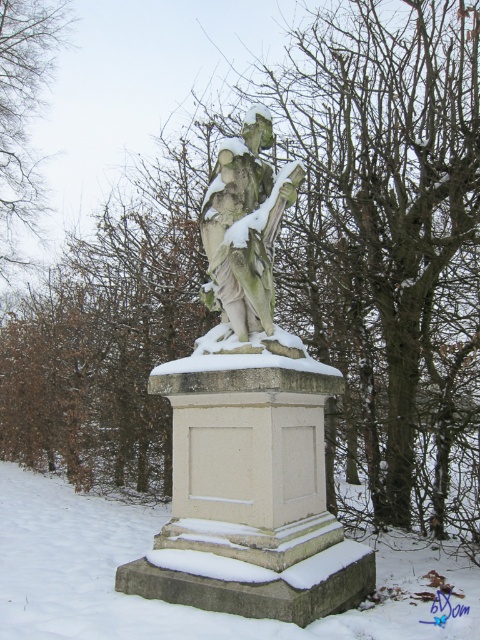
You are an artist planning to paint the statue and its surroundings. You want to ensure the white frosty snow at base and the brown leafless tree at upper left are proportionally accurate. Based on the scene, which object should you depict as larger in your painting?

The brown leafless tree at upper left should be depicted as larger in the painting because the white frosty snow at base has a smaller size compared to it.

From the picture: You are a delivery person trying to navigate through the snowy area. You need to place a package between the stone statue at center and the brown leafless tree at upper left. Is there enough space to place the package there?

The stone statue at center and brown leafless tree at upper left are 8.16 meters apart, so there is sufficient space to place the package between them.

In the scene shown: You are standing near the statue and want to take a photo of the brown leafless tree at upper left without the white frosty snow at base in the frame. Which direction should you move to ensure the tree is visible while excluding the snow?

Move upwards or adjust your camera angle to focus on the brown leafless tree at upper left while avoiding the white frosty snow at base, which is located below it.